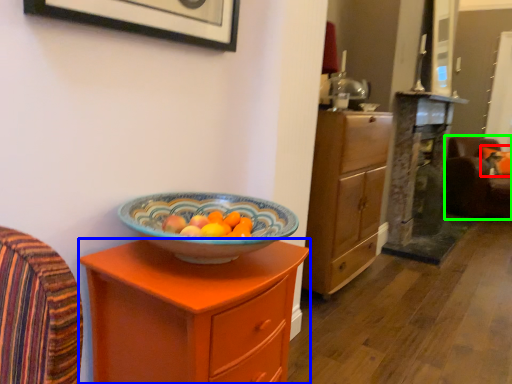
Question: Based on their relative distances, which object is farther from pillow (highlighted by a red box)? Choose from chest of drawers (highlighted by a blue box) and swivel chair (highlighted by a green box).

Choices:
 (A) chest of drawers
 (B) swivel chair

Answer: (A)